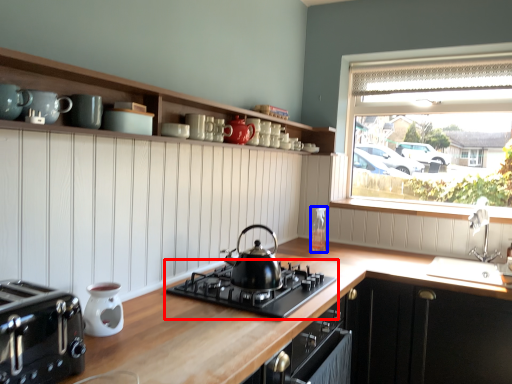
Question: Which of the following is the farthest to the observer, gas stove (highlighted by a red box) or bottle (highlighted by a blue box)?

Choices:
 (A) gas stove
 (B) bottle

Answer: (B)